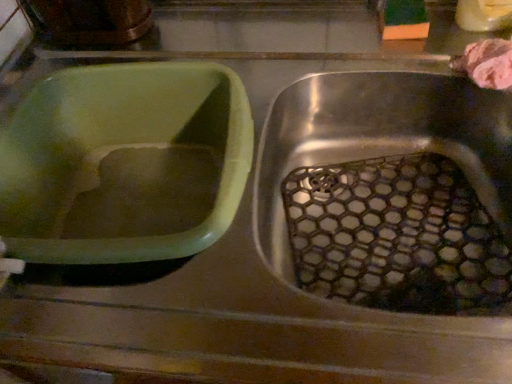
The height and width of the screenshot is (384, 512). I want to click on free spot to the left of pink fluffy sponge at upper right, so click(381, 64).